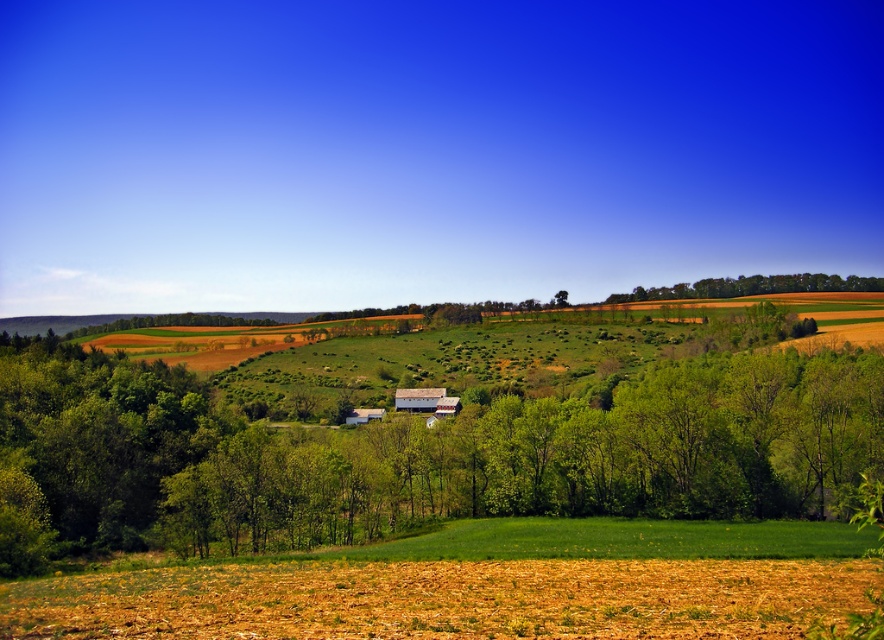
Does green leafy tree at center appear on the left side of green leafy trees at upper center?

Yes, green leafy tree at center is to the left of green leafy trees at upper center.

Looking at this image, who is positioned more to the right, green leafy tree at center or green leafy trees at upper center?

green leafy trees at upper center is more to the right.

Is point (280, 458) positioned after point (867, 278)?

No, (280, 458) is in front of (867, 278).

In order to click on green leafy tree at center in this screenshot , I will do `click(432, 436)`.